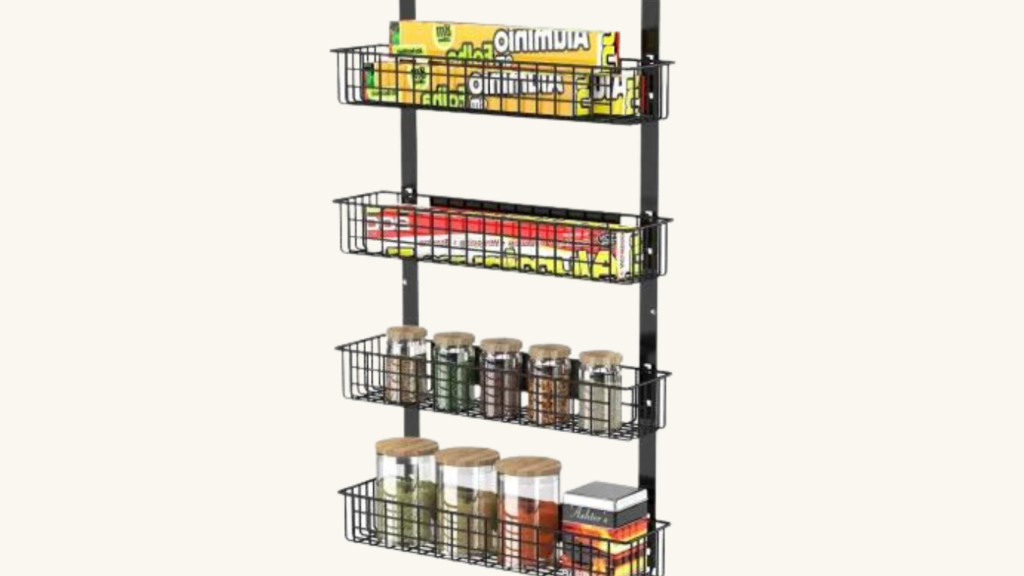
The width and height of the screenshot is (1024, 576). I want to click on left of pantry shelf organizer, so pyautogui.click(x=262, y=196).